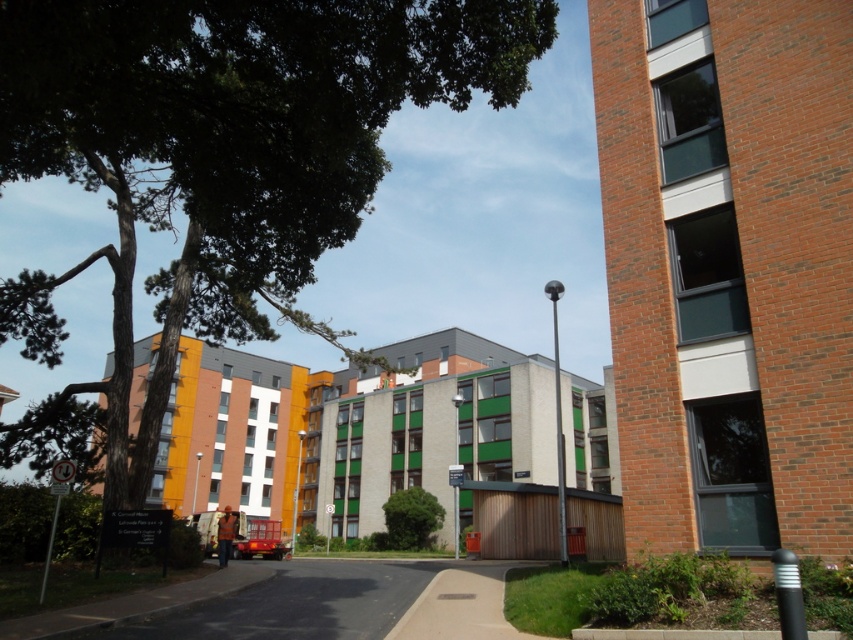
Between green leafy tree at upper left and green leafy tree at center, which one appears on the right side from the viewer's perspective?

green leafy tree at center is more to the right.

Who is more distant from viewer, [207,326] or [404,502]?

Point [404,502]

The width and height of the screenshot is (853, 640). Identify the location of green leafy tree at upper left. (222, 156).